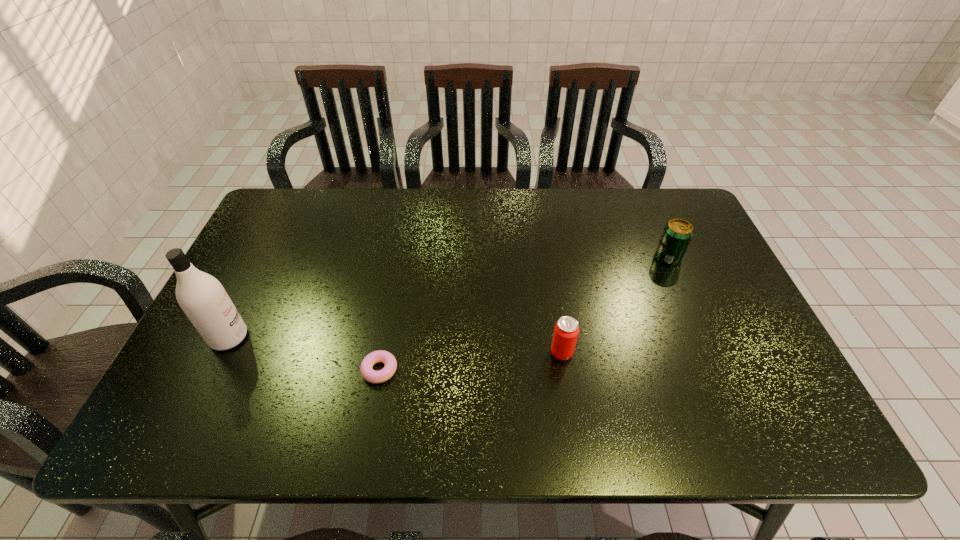
This screenshot has height=540, width=960. Identify the location of vacant region located on the front of the second object from right to left. (568, 397).

Locate an element on the screen. This screenshot has width=960, height=540. vacant space located 0.330m on the back of the doughnut is located at coordinates pos(399,260).

Where is `object situated at the left edge`? object situated at the left edge is located at coordinates (202, 297).

The height and width of the screenshot is (540, 960). Identify the location of object that is at the right edge. (677, 234).

In the image, there is a desktop. Identify the location of free space at the far edge. point(551,214).

The height and width of the screenshot is (540, 960). What are the coordinates of `blank space at the near edge of the desktop` in the screenshot? It's located at (302, 435).

Where is `vacant space at the left edge`? The image size is (960, 540). vacant space at the left edge is located at coordinates (247, 382).

Where is `vacant space at the right edge of the desktop`? The width and height of the screenshot is (960, 540). vacant space at the right edge of the desktop is located at coordinates (700, 235).

You are a GUI agent. You are given a task and a screenshot of the screen. Output one action in this format:
    pyautogui.click(x=<x>, y=<y>)
    Task: Click on the free location at the near left corner of the desktop
    This screenshot has width=960, height=540.
    Given the screenshot: What is the action you would take?
    coord(228,409)

The image size is (960, 540). In the image, there is a desktop. Identify the location of free space at the far right corner. (692, 218).